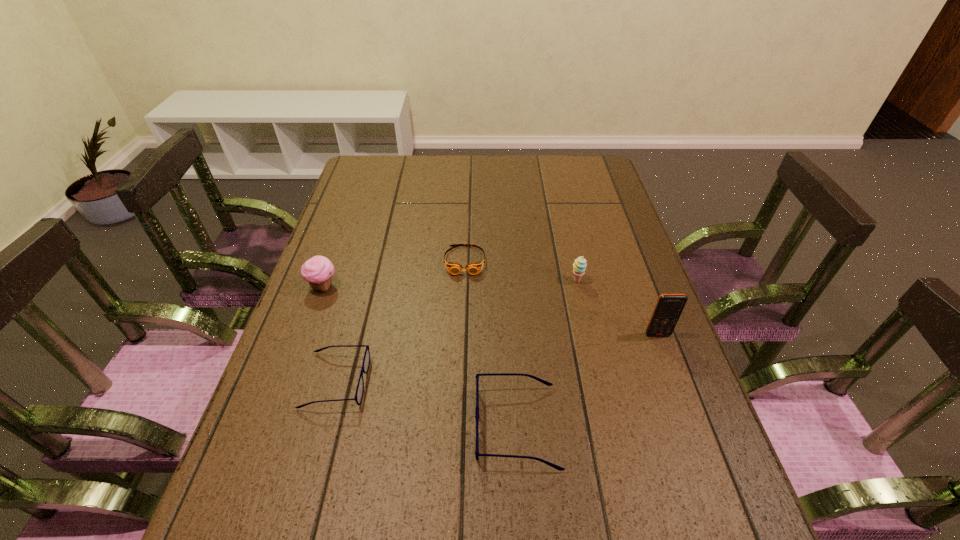
In order to click on free spot located on the front-facing side of the right spectacles in this screenshot , I will do `click(372, 426)`.

This screenshot has height=540, width=960. I want to click on free space located on the front-facing side of the right spectacles, so click(402, 426).

Find the location of `free space located 0.320m on the left of the sherbert`. free space located 0.320m on the left of the sherbert is located at coordinates (453, 281).

You are a GUI agent. You are given a task and a screenshot of the screen. Output one action in this format:
    pyautogui.click(x=<x>, y=<y>)
    Task: Click on the vacant area located 0.080m on the right of the cupcake
    The height and width of the screenshot is (540, 960).
    Given the screenshot: What is the action you would take?
    pyautogui.click(x=369, y=286)

Where is `vacant area situated on the screen of the cellular telephone`? vacant area situated on the screen of the cellular telephone is located at coordinates (682, 400).

At what (x,y) coordinates should I click in order to perform the action: click on vacant area located with the lenses facing forward on the goggles. Please return your answer as a coordinate pair (x, y). This screenshot has height=540, width=960. Looking at the image, I should click on (464, 295).

Where is `object at the near edge`? This screenshot has height=540, width=960. object at the near edge is located at coordinates (477, 454).

I want to click on spectacles at the left edge, so click(366, 360).

Find the location of `cupcake at the left edge`. cupcake at the left edge is located at coordinates (318, 271).

Locate an element on the screen. object that is at the right edge is located at coordinates (668, 308).